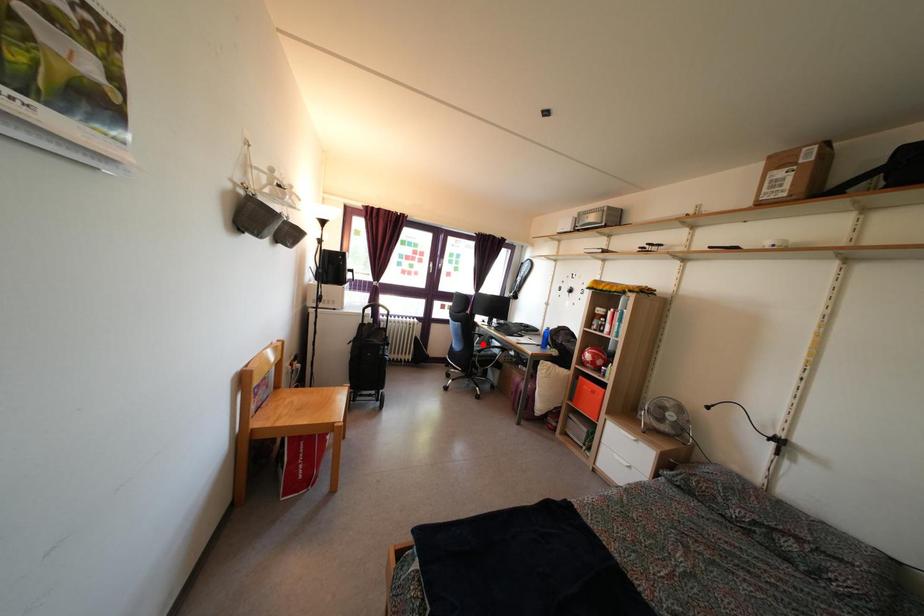
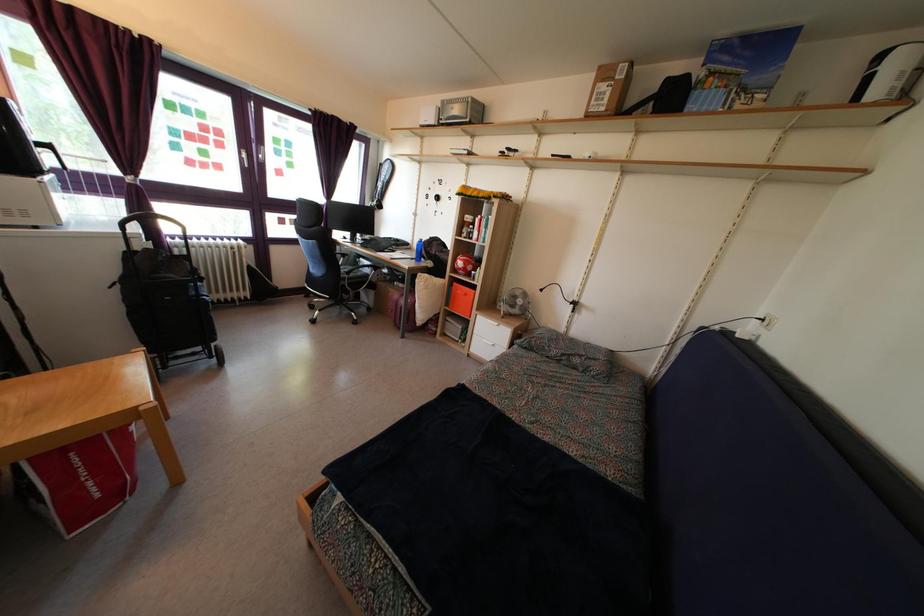
Locate, in the second image, the point that corresponds to the highlighted location in the first image.

(346, 264)